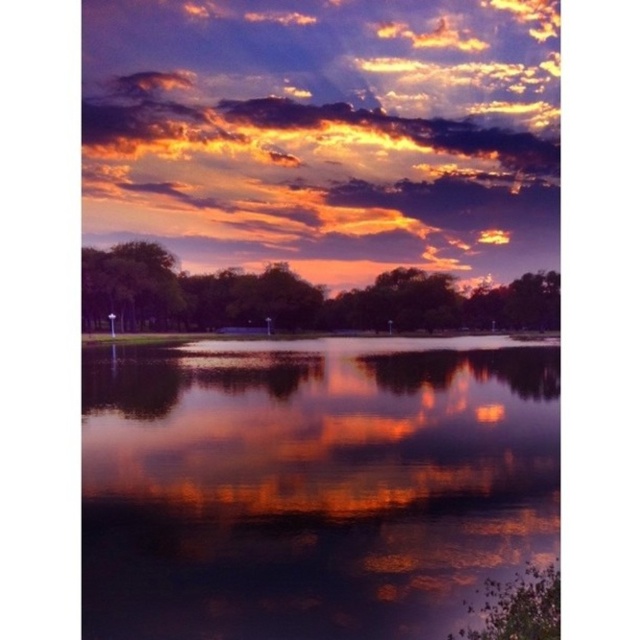
Can you confirm if glossy reflective water at center is positioned above shiny orange cloud at upper center?

Answer: Actually, glossy reflective water at center is below shiny orange cloud at upper center.

Does point (401, 548) lie behind point (532, 93)?

No, it is not.

Is point (84, 401) positioned before point (115, 218)?

That is True.

I want to click on glossy reflective water at center, so click(x=310, y=484).